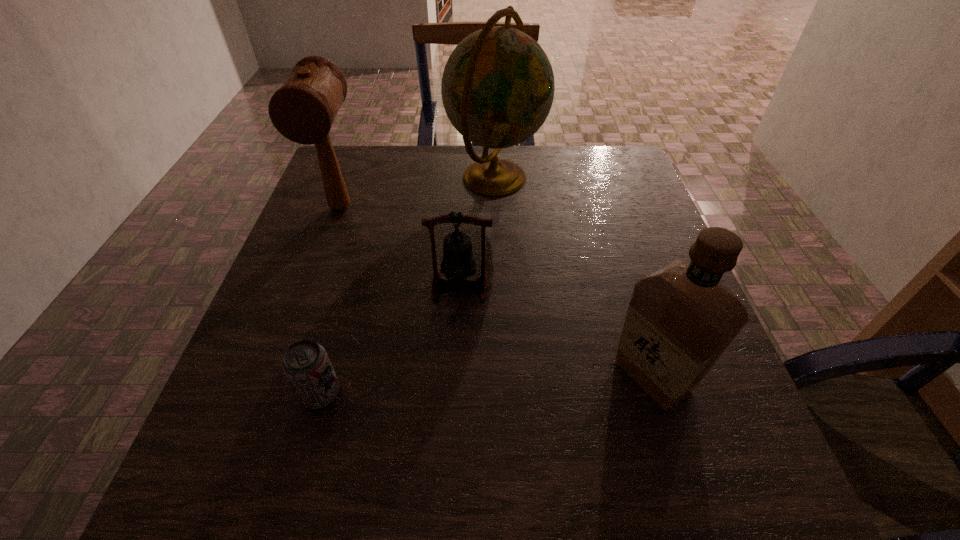
The height and width of the screenshot is (540, 960). I want to click on the tallest object, so click(497, 89).

The image size is (960, 540). In order to click on mallet in this screenshot , I will do `click(303, 109)`.

Image resolution: width=960 pixels, height=540 pixels. What are the coordinates of `the rightmost object` in the screenshot? It's located at (681, 318).

I want to click on the third farthest object, so click(458, 263).

Locate an element on the screen. bell is located at coordinates (458, 263).

I want to click on the shortest object, so click(306, 364).

Image resolution: width=960 pixels, height=540 pixels. In order to click on vacant space located on the right of the globe in this screenshot , I will do `click(576, 177)`.

Locate an element on the screen. free space located on the strike surface of the mallet is located at coordinates (319, 267).

Image resolution: width=960 pixels, height=540 pixels. Identify the location of vacant region located on the front-facing side of the rightmost object. (434, 376).

You are a GUI agent. You are given a task and a screenshot of the screen. Output one action in this format:
    pyautogui.click(x=<x>, y=<y>)
    Task: Click on the blank area located on the front-facing side of the rightmost object
    This screenshot has height=540, width=960.
    Given the screenshot: What is the action you would take?
    pyautogui.click(x=495, y=376)